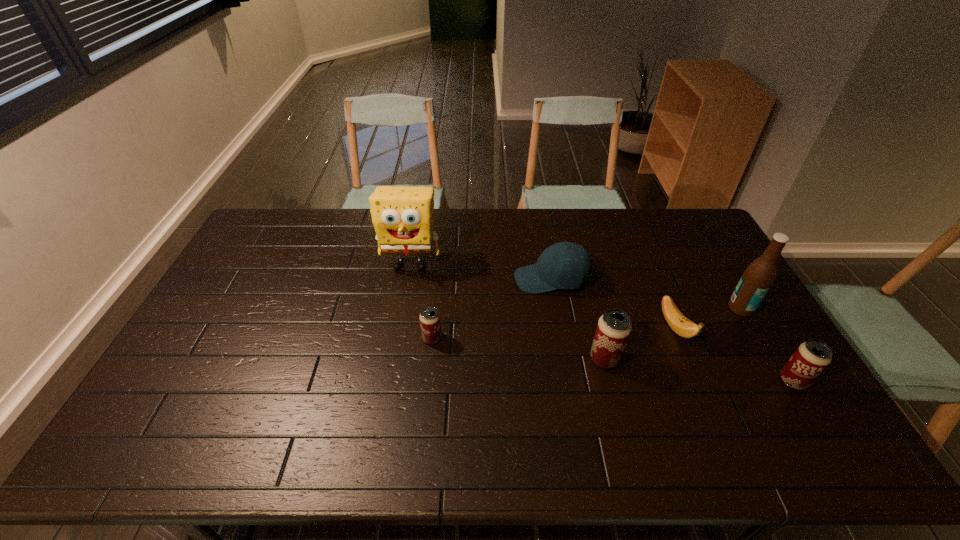
At what (x,y) coordinates should I click in order to perform the action: click on the leftmost beer can. Please return your answer as a coordinate pair (x, y). Looking at the image, I should click on (430, 324).

Find the location of a particular element. This screenshot has height=540, width=960. the shortest beer can is located at coordinates (430, 324).

Where is `the second beer can from right to left`? the second beer can from right to left is located at coordinates point(614,327).

The height and width of the screenshot is (540, 960). In order to click on the second tallest beer can in this screenshot , I will do `click(811, 358)`.

Identify the location of beer bottle. (756, 281).

Find the location of `baseball cap`. baseball cap is located at coordinates (565, 265).

The height and width of the screenshot is (540, 960). Identify the location of sponge. (402, 217).

Where is `banana`? This screenshot has height=540, width=960. banana is located at coordinates (681, 325).

Find the location of a particular element. Image resolution: width=960 pixels, height=540 pixels. vacant space located 0.100m on the back of the leftmost beer can is located at coordinates (435, 306).

The image size is (960, 540). I want to click on vacant space located on the right of the second beer can from right to left, so click(674, 359).